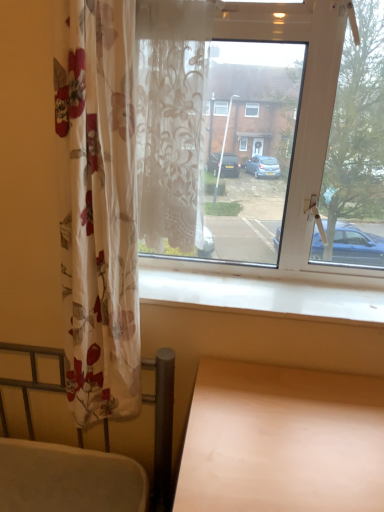
You are a GUI agent. You are given a task and a screenshot of the screen. Output one action in this format:
    pyautogui.click(x=<x>, y=<y>)
    Task: Click on the free space above light wood table at lower right (from a real-world perspective)
    The height and width of the screenshot is (512, 384).
    Given the screenshot: What is the action you would take?
    pyautogui.click(x=294, y=424)